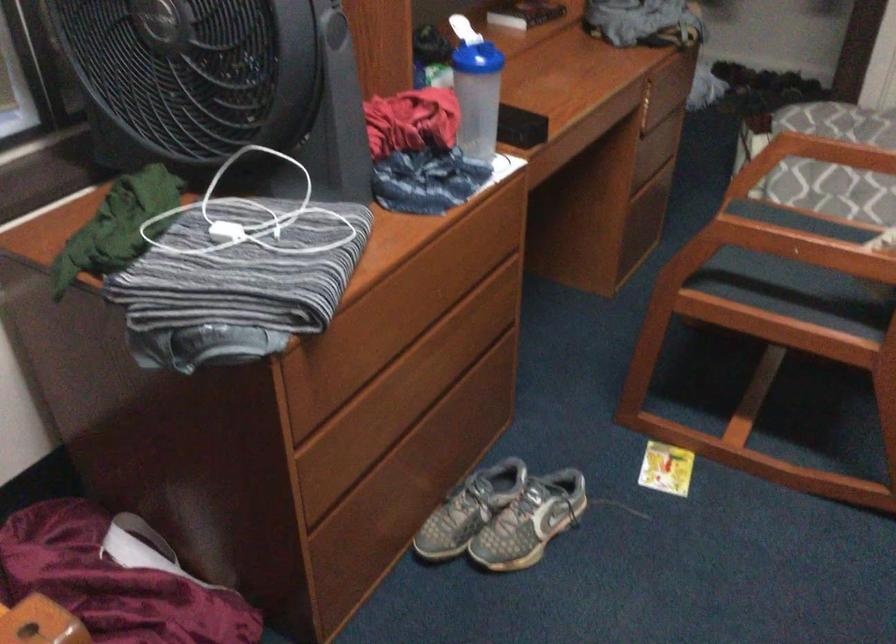
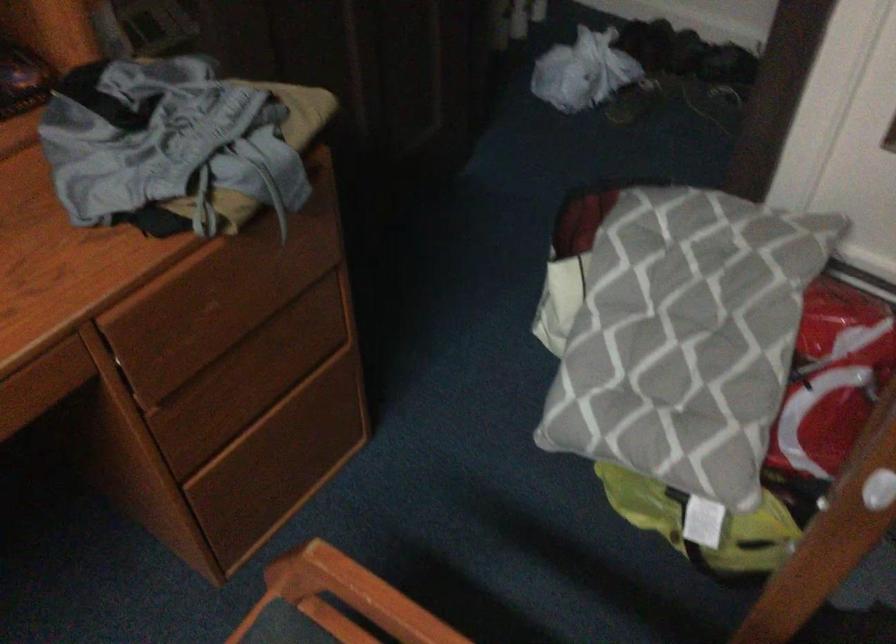
The point at (666, 69) is marked in the first image. Where is the corresponding point in the second image?

(196, 294)